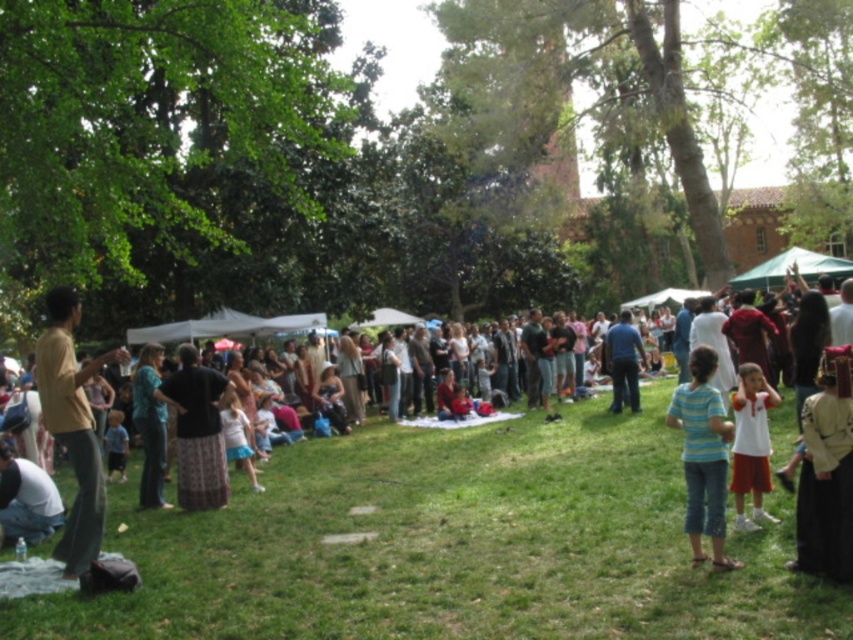
Question: Does white textured dress at lower right have a smaller size compared to blue shirt at center?

Choices:
 (A) no
 (B) yes

Answer: (A)

Question: Which point is farther to the camera?

Choices:
 (A) green grass at center
 (B) white cotton shirt at lower left
 (C) white cotton shirt at center

Answer: (B)

Question: Which object is farther from the camera taking this photo?

Choices:
 (A) blue shirt at center
 (B) white textured dress at lower right
 (C) white cotton shirt at center

Answer: (A)

Question: Which point is closer to the camera taking this photo?

Choices:
 (A) (695, 420)
 (B) (752, 525)
 (C) (810, 556)

Answer: (C)

Question: Where is white textured dress at lower right located in relation to teal fabric shirt at center in the image?

Choices:
 (A) below
 (B) above

Answer: (B)

Question: Can you confirm if green grass at center is thinner than patterned fabric skirt at center?

Choices:
 (A) no
 (B) yes

Answer: (A)